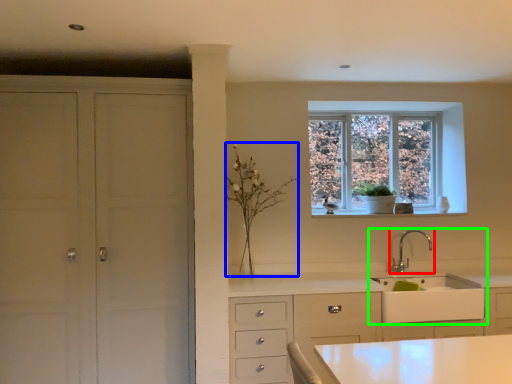
Question: Which object is the closest to the tap (highlighted by a red box)? Choose among these: plant (highlighted by a blue box) or sink (highlighted by a green box).

Choices:
 (A) plant
 (B) sink

Answer: (B)